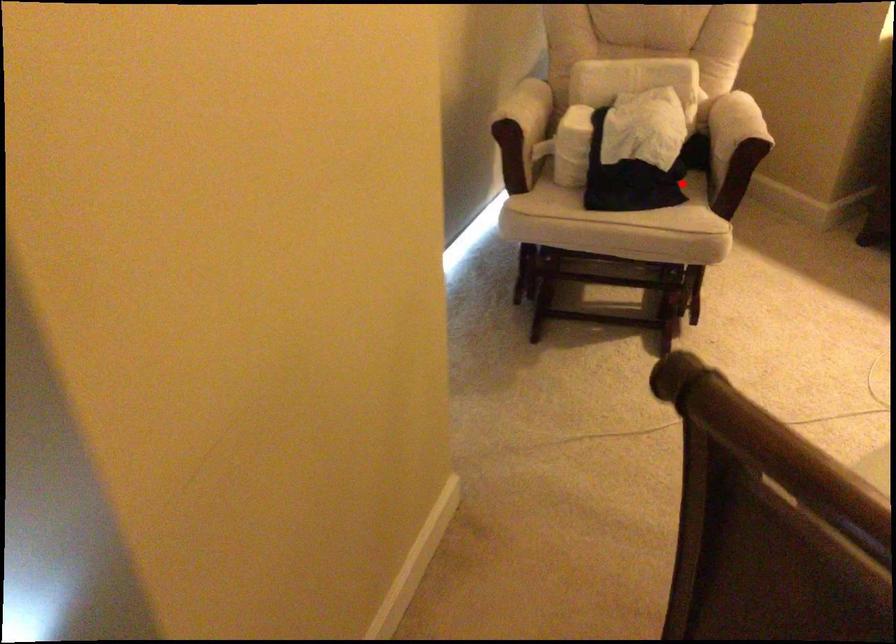
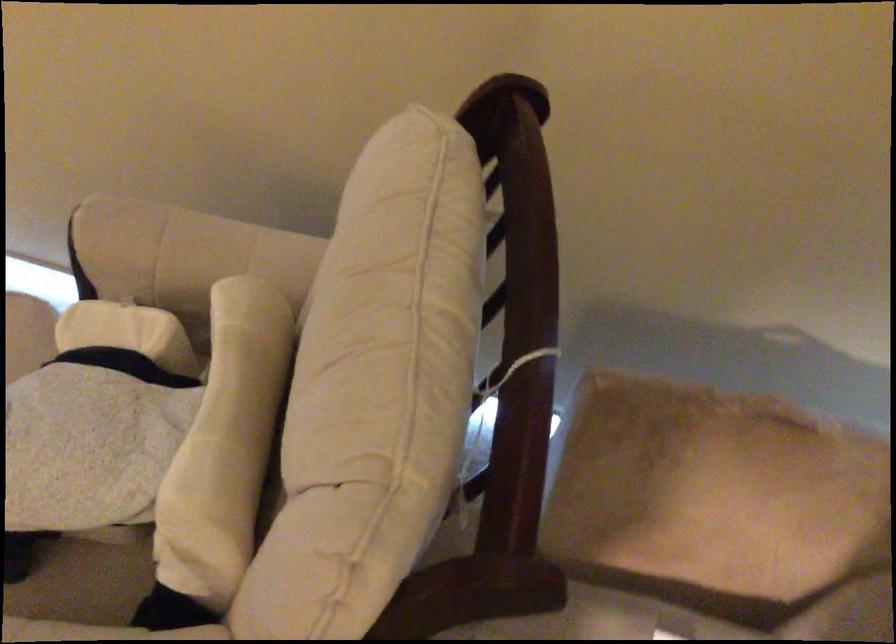
Where in the second image is the point corresponding to the highlighted location from the first image?

(82, 583)